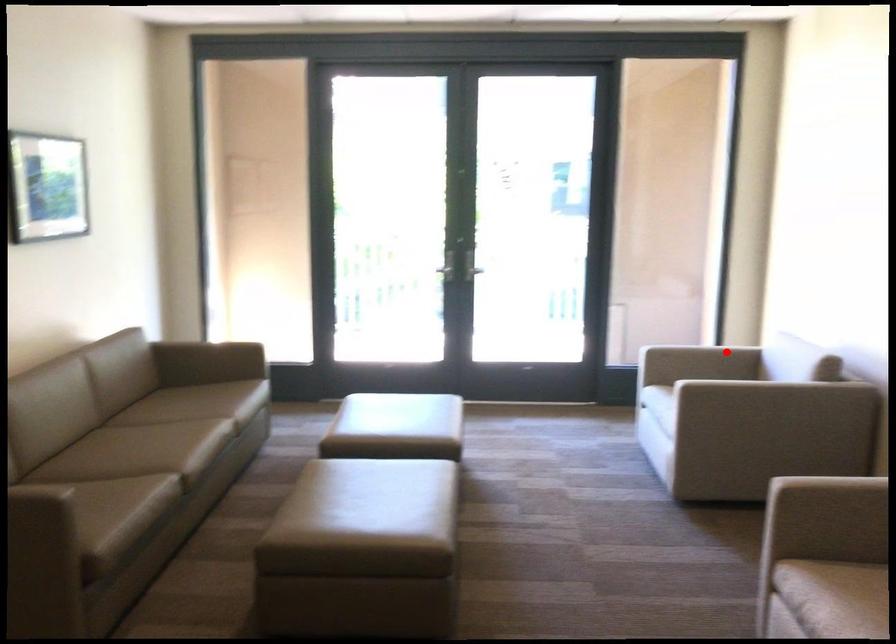
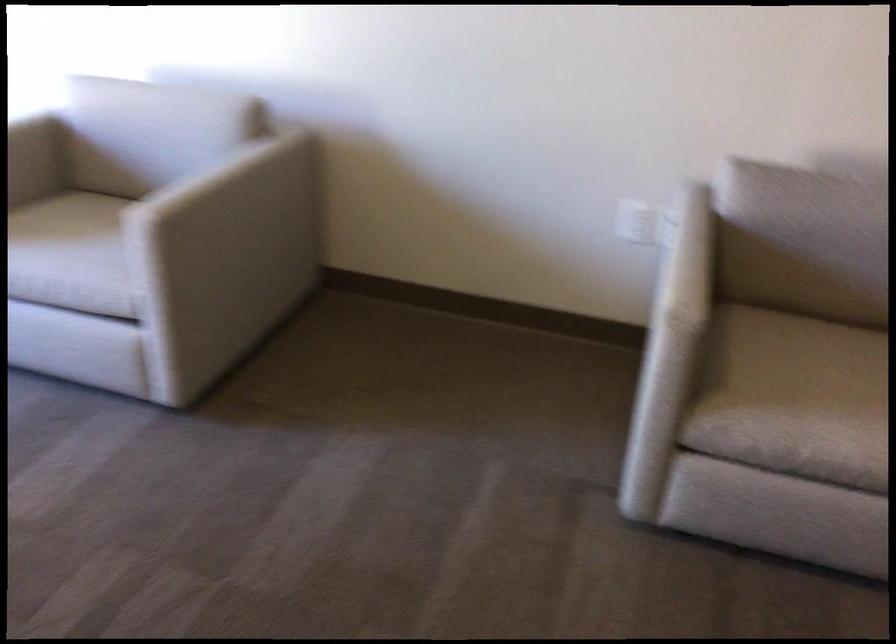
Find the pixel in the second image that matches the highlighted location in the first image.

(28, 124)